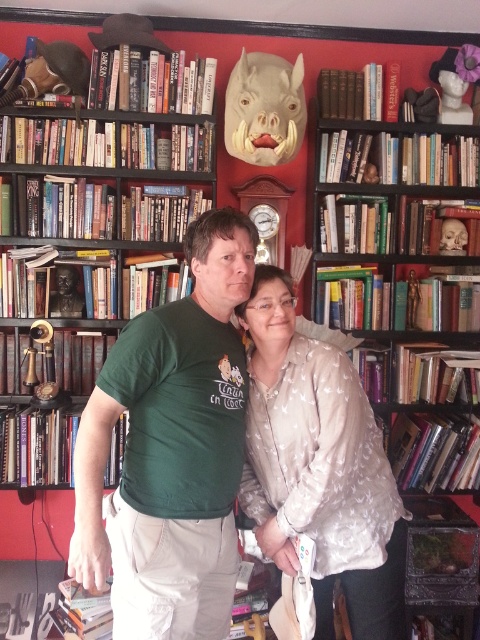
You are standing in front of the bookshelf and want to reach two specific points marked in the image. The first point is at coordinates point (60, 211) and the second is at point (392, 296). Which point is closer to you?

Point (60, 211) is closer to the viewer than point (392, 296).

You are a photographer trying to capture a wide shot of the wooden bookshelf at left and the hardcover books at right. The camera you are using has a minimum focusing distance of 36 inches. Can you take a clear photo of both objects without moving the camera closer?

The distance between the wooden bookshelf at left and hardcover books at right is 34.61 inches, which is less than the camera minimum focusing distance of 36 inches. Therefore, you cannot take a clear photo of both objects without moving the camera closer.

You are a photographer trying to capture a clear shot of the silky beige blouse at center and the hardcover books at right. Based on their widths, which one should you zoom in on first to ensure they both fit in the frame?

The hardcover books at right might be wider than silky beige blouse at center, so you should zoom out first to accommodate the wider object before focusing on the other.